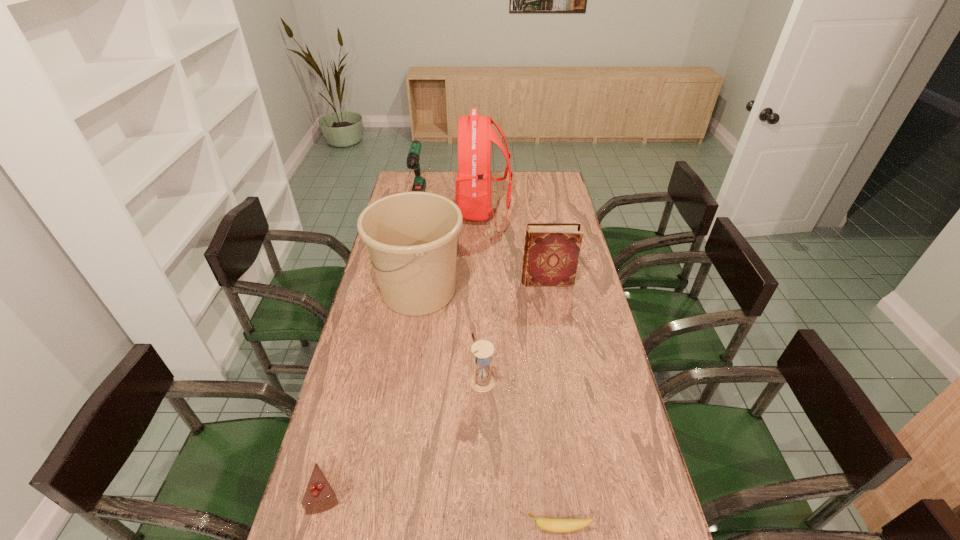
I want to click on free space located on the main compartment of the backpack, so click(429, 212).

The width and height of the screenshot is (960, 540). Find the location of `blank area located on the back of the bucket`. blank area located on the back of the bucket is located at coordinates (427, 239).

I want to click on vacant region located 0.170m on the handle side of the drill, so click(410, 238).

Identify the location of vacant space located on the spine side of the hardback book. (459, 281).

Locate an element on the screen. The height and width of the screenshot is (540, 960). free space located on the spine side of the hardback book is located at coordinates (503, 281).

The width and height of the screenshot is (960, 540). What are the coordinates of `free space located 0.210m on the spine side of the hardback book` in the screenshot? It's located at (467, 281).

The image size is (960, 540). In order to click on vacant space located 0.060m on the left of the fifth farthest object in this screenshot , I will do tap(451, 381).

This screenshot has width=960, height=540. In order to click on vacant region located on the back of the second nearest object in this screenshot , I will do `click(363, 354)`.

Identify the location of free space located at the stem of the nearest object. This screenshot has height=540, width=960. (479, 528).

Where is `vacant point located 0.290m at the stem of the nearest object`? Image resolution: width=960 pixels, height=540 pixels. vacant point located 0.290m at the stem of the nearest object is located at coordinates (402, 528).